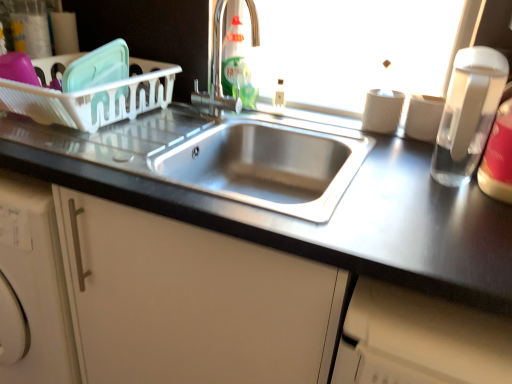
Locate an element on the screen. Image resolution: width=512 pixels, height=384 pixels. free space to the left of clear plastic bottle at right, the first bottle viewed from the right is located at coordinates (426, 202).